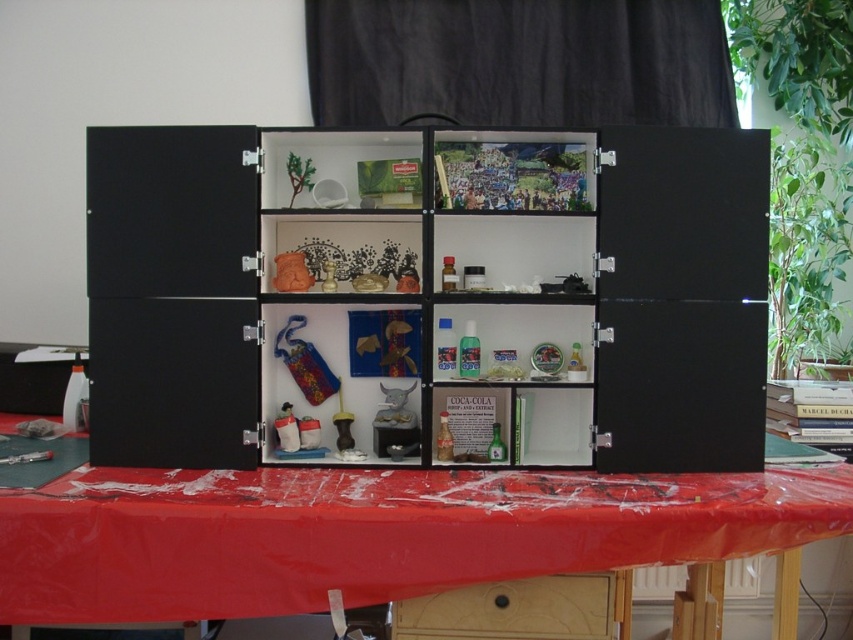
Between point (494, 595) and point (554, 369), which one is positioned behind?

The point (554, 369) is behind.

You are a GUI agent. You are given a task and a screenshot of the screen. Output one action in this format:
    pyautogui.click(x=<x>, y=<y>)
    Task: Click on the wooden drawer at lower center
    This screenshot has width=853, height=640.
    Given the screenshot: What is the action you would take?
    pyautogui.click(x=512, y=611)

The width and height of the screenshot is (853, 640). What do you see at coordinates (372, 532) in the screenshot?
I see `red plastic table at center` at bounding box center [372, 532].

I want to click on red plastic table at center, so click(x=372, y=532).

Where is `red plastic table at center`? This screenshot has width=853, height=640. red plastic table at center is located at coordinates (372, 532).

Between wooden drawer at lower center and matte orange vase at center, which one is positioned higher?

matte orange vase at center is higher up.

Is wooden drawer at lower center in front of matte orange vase at center?

Yes, it is.

Does point (486, 627) come farther from viewer compared to point (338, 220)?

That is False.

The height and width of the screenshot is (640, 853). Identify the location of wooden drawer at lower center. (512, 611).